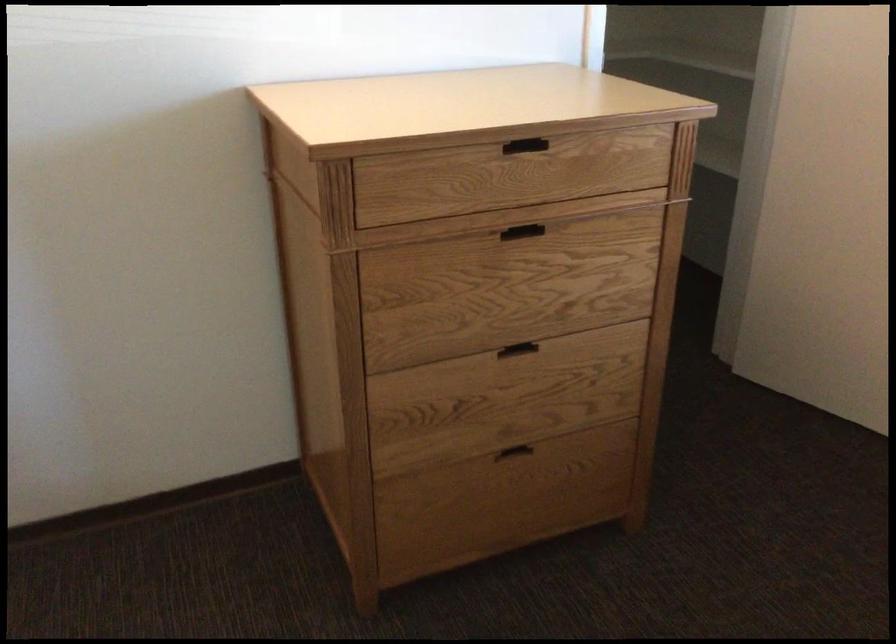
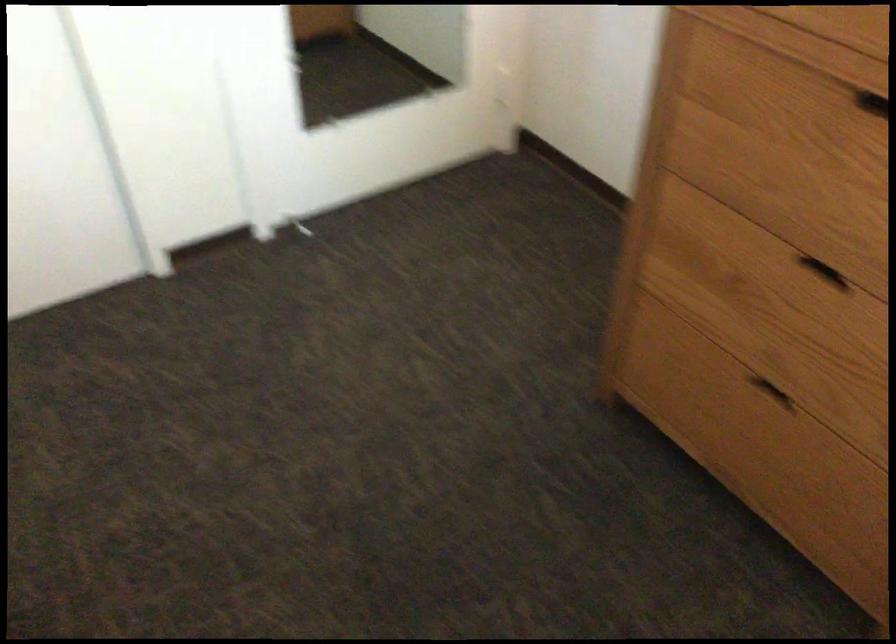
The point at (504, 453) is marked in the first image. Where is the corresponding point in the second image?

(770, 392)